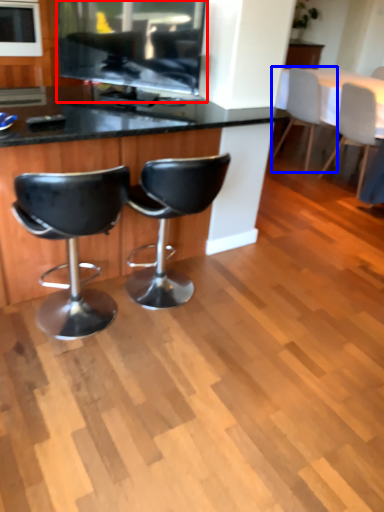
Question: Which point is closer to the camera, appliance (highlighted by a red box) or chair (highlighted by a blue box)?

Choices:
 (A) appliance
 (B) chair

Answer: (A)